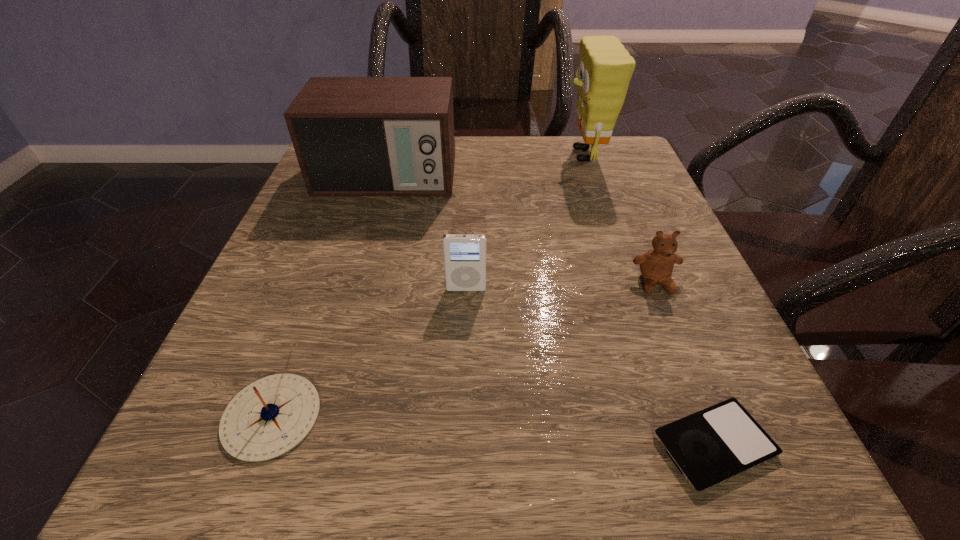
This screenshot has width=960, height=540. Identify the location of vacant region that satisfies the following two spatial constraints: 1. on the face of the tallest object; 2. on the front-facing side of the taller iPod. (630, 289).